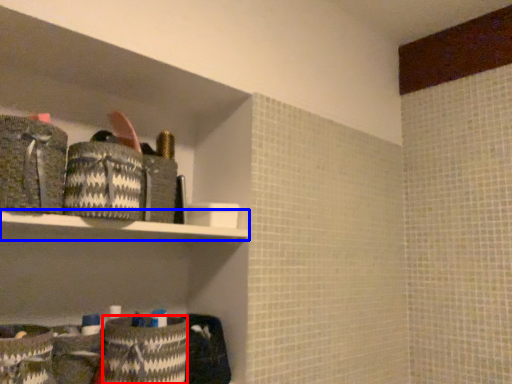
Question: Which object appears farthest to the camera in this image, material (highlighted by a red box) or shelf (highlighted by a blue box)?

Choices:
 (A) material
 (B) shelf

Answer: (A)